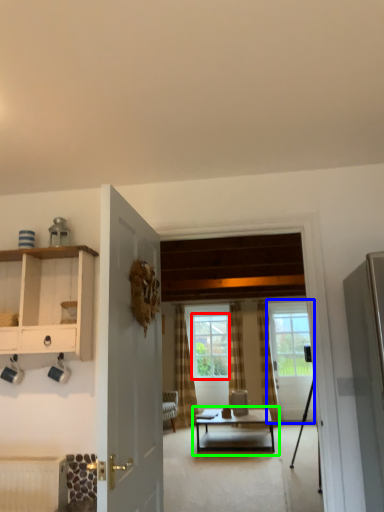
Question: Which object is the closest to the window (highlighted by a red box)? Choose among these: door (highlighted by a blue box) or coffee table (highlighted by a green box).

Choices:
 (A) door
 (B) coffee table

Answer: (A)